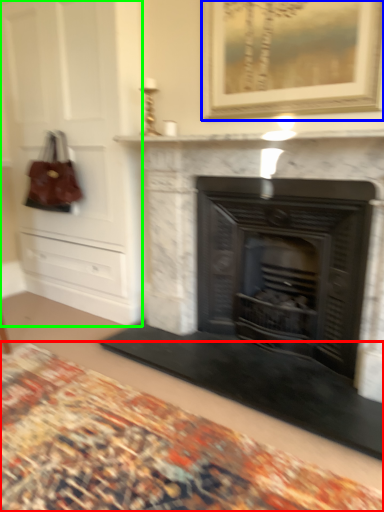
Question: Considering the real-world distances, which object is farthest from plain (highlighted by a red box)? picture frame (highlighted by a blue box) or dresser (highlighted by a green box)?

Choices:
 (A) picture frame
 (B) dresser

Answer: (A)